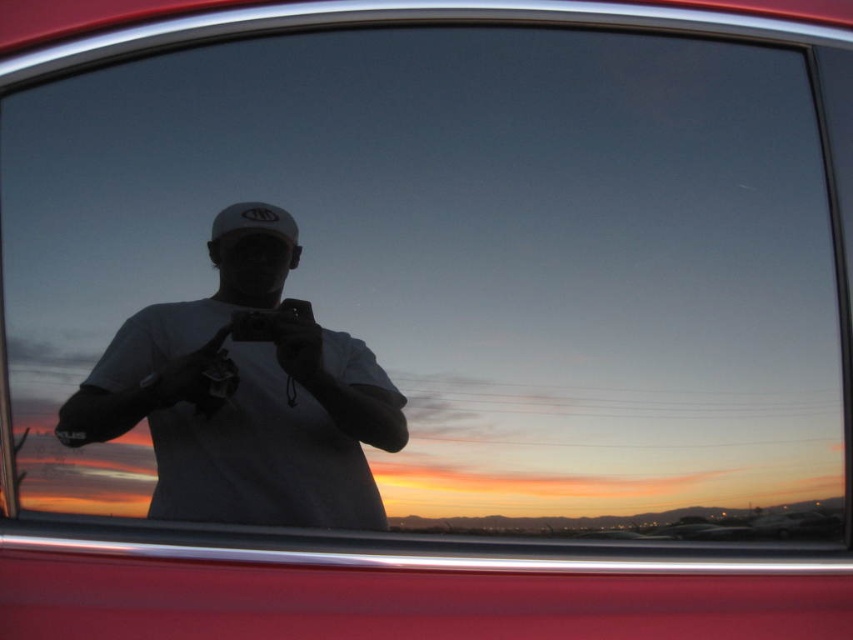
Between white matte shirt at center and white matte baseball hat at center, which one appears on the right side from the viewer's perspective?

white matte baseball hat at center

Between point (201, 488) and point (279, 205), which one is positioned in front?

Point (201, 488) is in front.

Between point (221, 298) and point (270, 234), which one is positioned behind?

The point (221, 298) is more distant.

Identify the location of white matte shirt at center. The height and width of the screenshot is (640, 853). (247, 401).